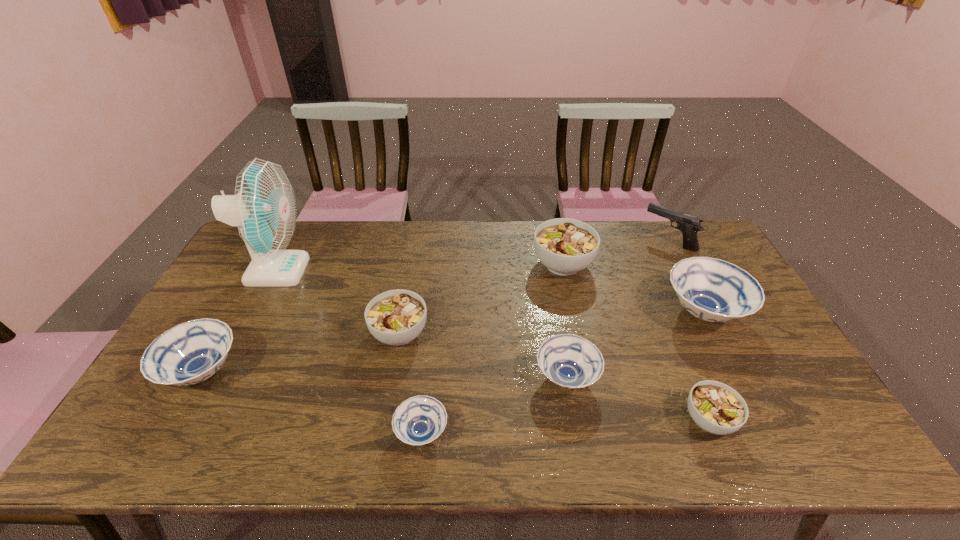
Point out which white soup bowl is positioned as the second nearest to the rightmost blue soup bowl. Please provide its 2D coordinates. Your answer should be formatted as a tuple, i.e. [(x, y)], where the tuple contains the x and y coordinates of a point satisfying the conditions above.

[(717, 408)]

Choose which white soup bowl is the third nearest neighbor to the gun. Please provide its 2D coordinates. Your answer should be formatted as a tuple, i.e. [(x, y)], where the tuple contains the x and y coordinates of a point satisfying the conditions above.

[(396, 317)]

Identify which blue soup bowl is the nearest to the leftmost blue soup bowl. Please provide its 2D coordinates. Your answer should be formatted as a tuple, i.e. [(x, y)], where the tuple contains the x and y coordinates of a point satisfying the conditions above.

[(419, 420)]

Identify the location of blue soup bowl identified as the second closest to the black gun. This screenshot has height=540, width=960. (569, 361).

You are a GUI agent. You are given a task and a screenshot of the screen. Output one action in this format:
    pyautogui.click(x=<x>, y=<y>)
    Task: Click on the blank area in the image that satisfies the following two spatial constraints: 1. on the back side of the third biggest blue soup bowl; 2. in front of the fan to face the airflow
    The width and height of the screenshot is (960, 540).
    Given the screenshot: What is the action you would take?
    pyautogui.click(x=548, y=271)

Where is `free region that satisfies the following two spatial constraints: 1. in front of the second farthest white soup bowl to face the airflow; 2. on the right side of the tallest object`? Image resolution: width=960 pixels, height=540 pixels. free region that satisfies the following two spatial constraints: 1. in front of the second farthest white soup bowl to face the airflow; 2. on the right side of the tallest object is located at coordinates (243, 333).